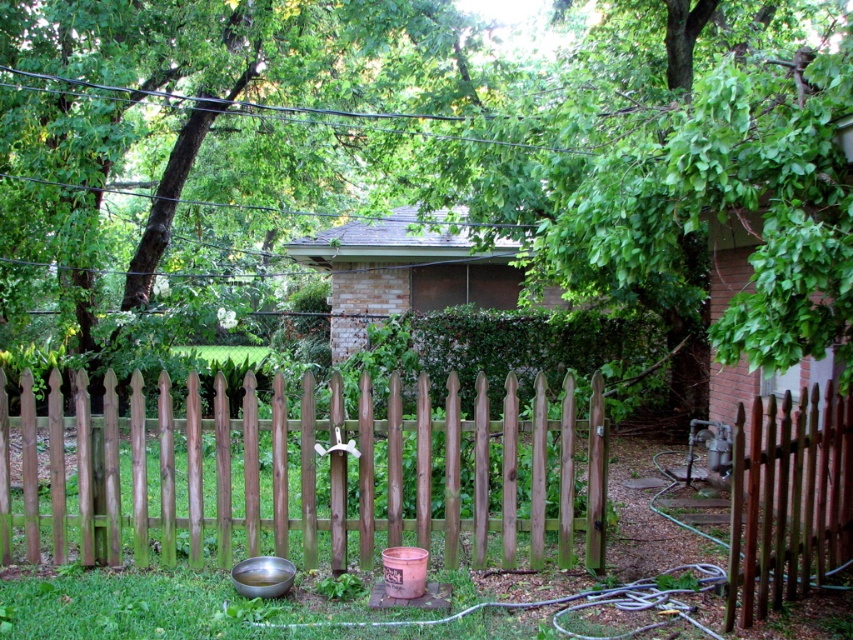
You are standing in the backyard and want to walk towards the brown wooden fence at right. Which direction should you move relative to the brown wooden fence at center?

You should move to the right of the brown wooden fence at center because the brown wooden fence at right is positioned to its right side, so moving that direction would lead you toward it.

In the scene shown: You are standing in the backyard and want to take a photo of the green leafy tree at upper center. Based on its position coordinates, where should you aim your camera?

The green leafy tree at upper center is located at coordinates point (196, 147), so aim your camera towards that point to capture it.